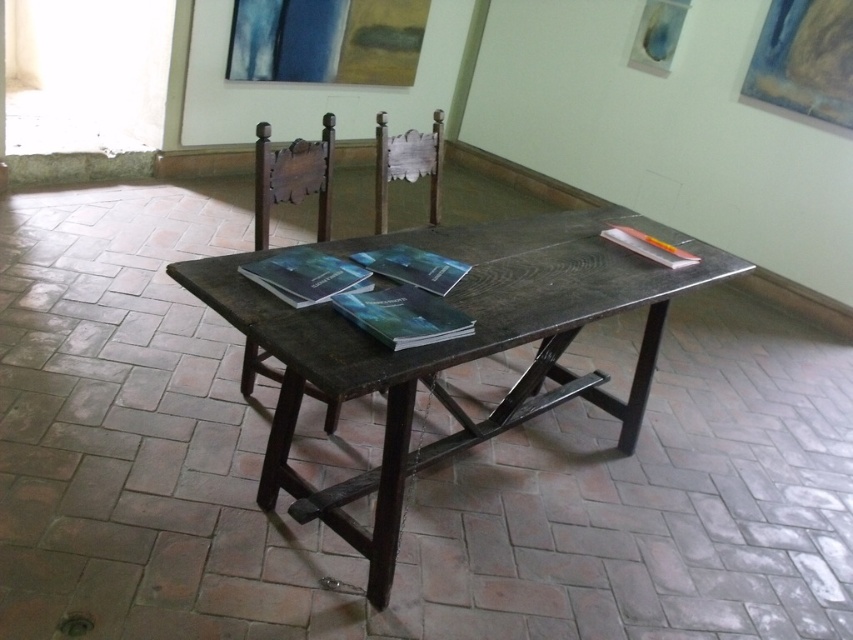
Is dark wood table at center bigger than wooden chair at center?

Indeed, dark wood table at center has a larger size compared to wooden chair at center.

Is point (291, 384) farther from viewer compared to point (380, 122)?

No, (291, 384) is closer to viewer.

Where is `dark wood table at center`? Image resolution: width=853 pixels, height=640 pixels. dark wood table at center is located at coordinates (453, 348).

Between dark wood chair at center and wooden chair at center, which one appears on the right side from the viewer's perspective?

Positioned to the right is wooden chair at center.

Who is more forward, (296, 189) or (440, 116)?

Point (296, 189)

The image size is (853, 640). Identify the location of dark wood chair at center. (292, 177).

What are the coordinates of `dark wood chair at center` in the screenshot? It's located at (292, 177).

Does point (225, 289) lie in front of point (244, 376)?

Yes, it is.

Is point (274, 337) farther from viewer compared to point (260, 200)?

No, (274, 337) is closer to viewer.

Identify the location of dark wood table at center. The width and height of the screenshot is (853, 640). [x=453, y=348].